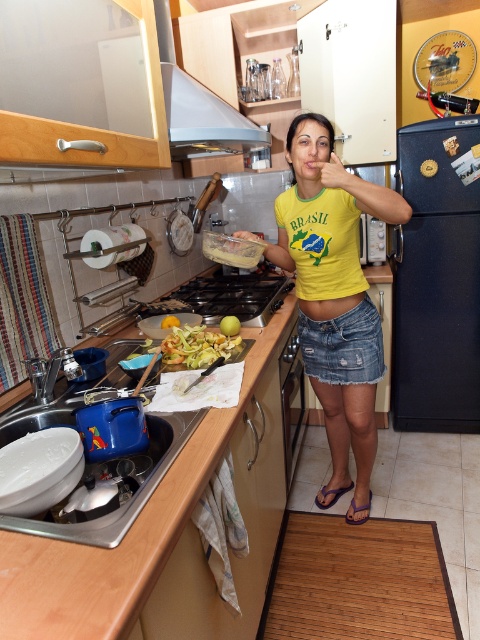
Between woodenmaterial/texturecounter top at center and yellowish matte vegetables at center, which one has more height?

Standing taller between the two is woodenmaterial/texturecounter top at center.

Is point (203, 554) positioned after point (175, 333)?

That is False.

Is point (167, 476) farther from viewer compared to point (171, 355)?

No, (167, 476) is closer to viewer.

Image resolution: width=480 pixels, height=640 pixels. I want to click on woodenmaterial/texturecounter top at center, so click(166, 536).

In the scene shown: Can you confirm if silver metallic exhaust hood at upper center is positioned below denim skirt at center?

No, silver metallic exhaust hood at upper center is not below denim skirt at center.

Which is behind, point (169, 132) or point (339, 358)?

The point (339, 358) is more distant.

At what (x,y) coordinates should I click in order to perform the action: click on silver metallic exhaust hood at upper center. Please return your answer as a coordinate pair (x, y). Looking at the image, I should click on (199, 108).

Who is more distant from viewer, (324, 342) or (186, 356)?

The point (324, 342) is behind.

Which is above, denim skirt at center or yellowish matte vegetables at center?

yellowish matte vegetables at center is above.

Who is more forward, (x=302, y=328) or (x=177, y=337)?

Point (x=177, y=337)

I want to click on denim skirt at center, so click(x=344, y=346).